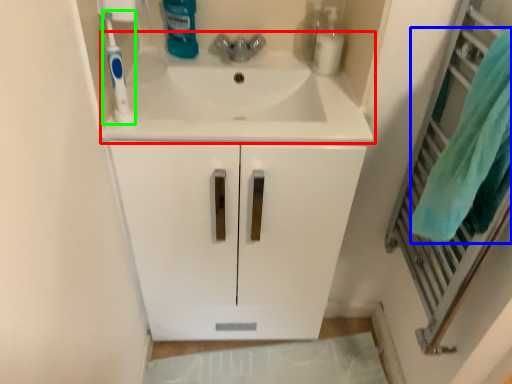
Question: Based on their relative distances, which object is nearer to sink (highlighted by a red box)? Choose from bath towel (highlighted by a blue box) and toothbrush (highlighted by a green box).

Choices:
 (A) bath towel
 (B) toothbrush

Answer: (B)